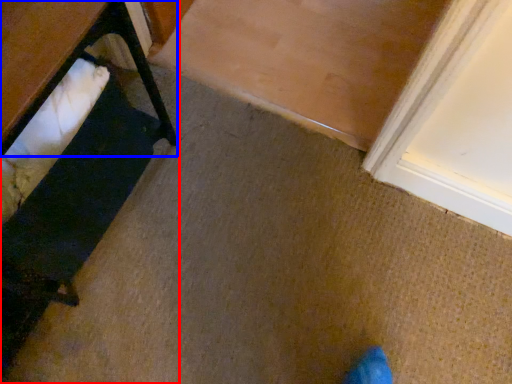
Question: Which point is closer to the camera, furniture (highlighted by a red box) or table (highlighted by a blue box)?

Choices:
 (A) furniture
 (B) table

Answer: (B)